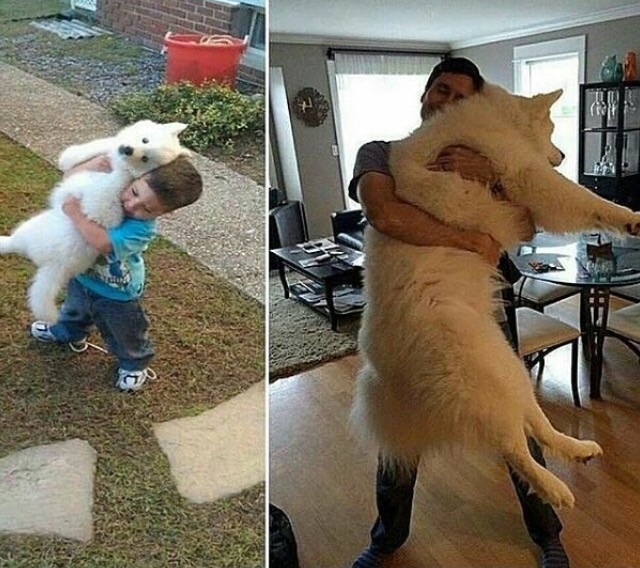
Find the location of a particular element. The image size is (640, 568). wine glasses hanging upside down is located at coordinates (596, 106), (612, 102), (628, 103).